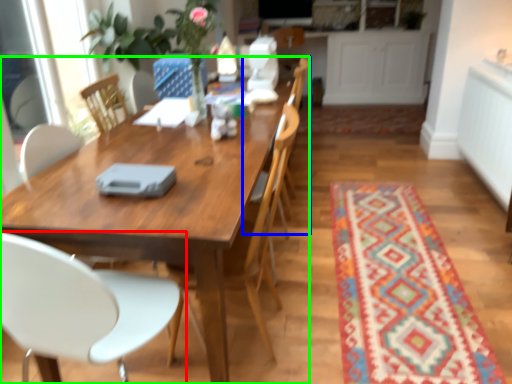
Question: Estimate the real-world distances between objects in this image. Which object is closer to chair (highlighted by a red box), armchair (highlighted by a blue box) or kitchen & dining room table (highlighted by a green box)?

Choices:
 (A) armchair
 (B) kitchen & dining room table

Answer: (B)